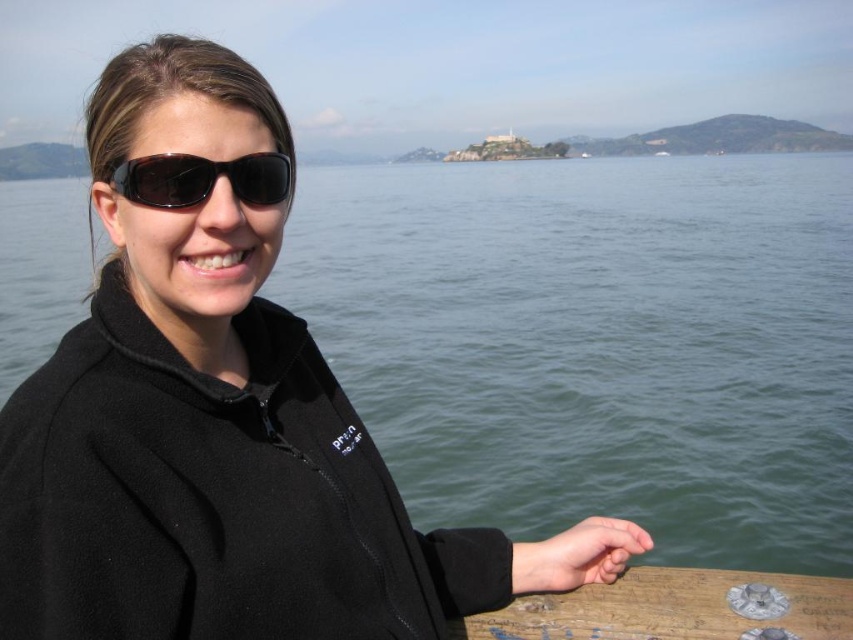
Is black plastic sunglasses at upper center above matte black hand at lower right?

Yes, black plastic sunglasses at upper center is above matte black hand at lower right.

Which of these two, black plastic sunglasses at upper center or matte black hand at lower right, stands shorter?

Standing shorter between the two is matte black hand at lower right.

Is point (157, 160) less distant than point (567, 580)?

Yes.

The height and width of the screenshot is (640, 853). Find the location of `black plastic sunglasses at upper center`. black plastic sunglasses at upper center is located at coordinates (202, 179).

Is green water at center shorter than matte black hand at lower right?

No.

Can you confirm if green water at center is wider than matte black hand at lower right?

Yes, green water at center is wider than matte black hand at lower right.

Is point (518, 426) more distant than point (585, 522)?

Yes, it is behind point (585, 522).

Locate an element on the screen. green water at center is located at coordinates (596, 342).

Is green water at center shorter than black plastic sunglasses at upper center?

No.

Does green water at center have a lesser width compared to black plastic sunglasses at upper center?

No.

Describe the element at coordinates (596, 342) in the screenshot. I see `green water at center` at that location.

Find the location of `green water at center`. green water at center is located at coordinates (596, 342).